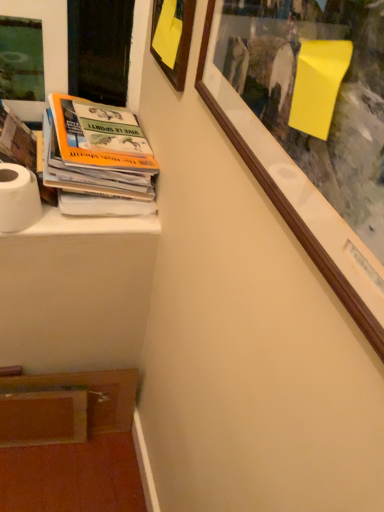
Find the location of a particular element. This screenshot has width=384, height=512. vacant area that is situated to the right of white matte toilet paper at lower left is located at coordinates (87, 222).